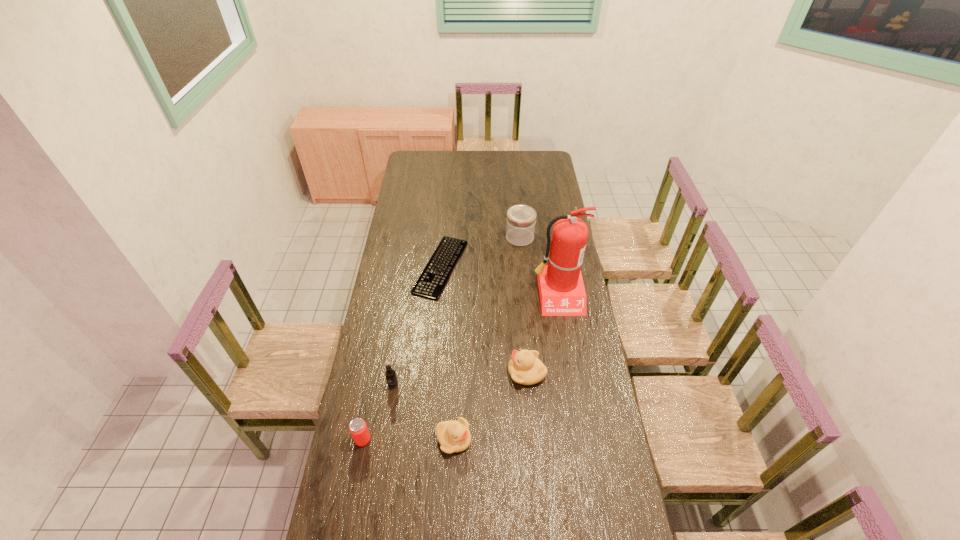
In the current image, all ducklings are evenly spaced. To maintain this equal spacing, where should an additional duckling be placed on the right? Please point out a free spot. Please provide its 2D coordinates. Your answer should be formatted as a tuple, i.e. [(x, y)], where the tuple contains the x and y coordinates of a point satisfying the conditions above.

[(586, 319)]